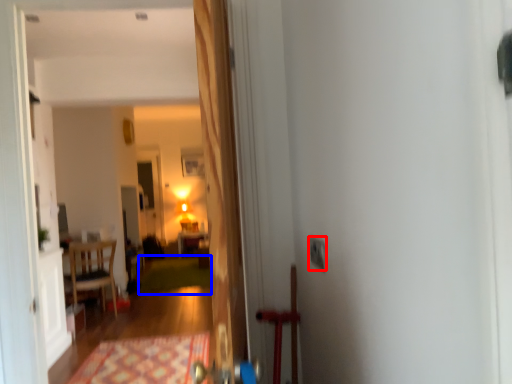
Question: Which point is closer to the camera, electric outlet (highlighted by a red box) or doormat (highlighted by a blue box)?

Choices:
 (A) electric outlet
 (B) doormat

Answer: (A)